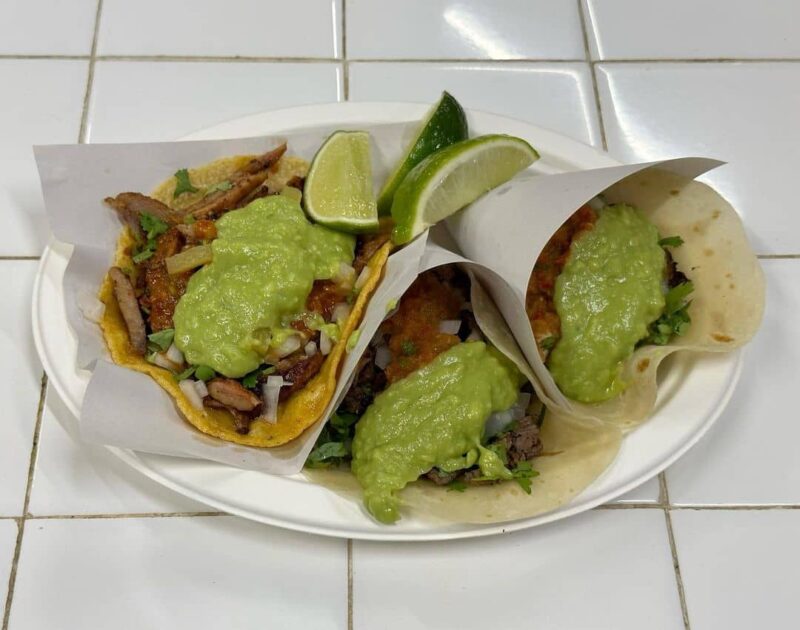
Find the location of `tile countertop`. tile countertop is located at coordinates (566, 89).